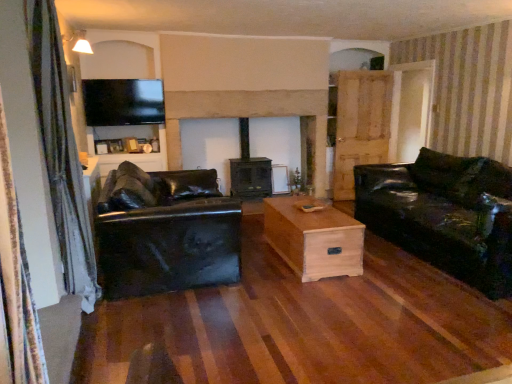
Find the location of `free point in front of light wood/texture coffee table at center`. free point in front of light wood/texture coffee table at center is located at coordinates (321, 299).